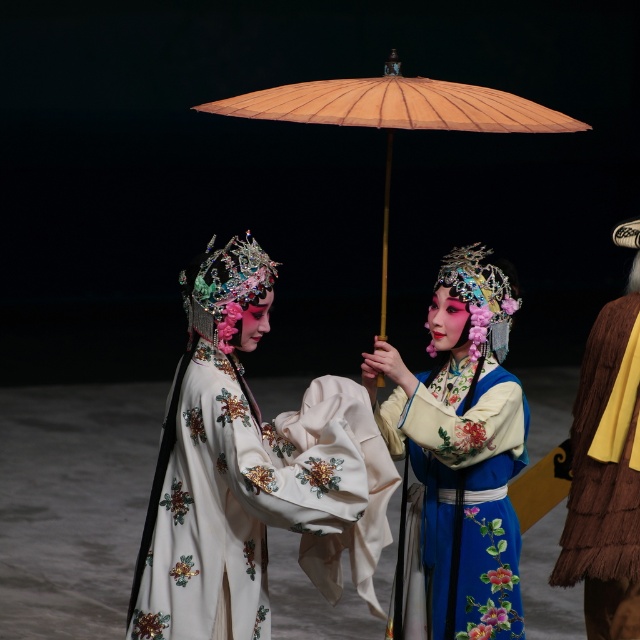
Question: Which point is farther to the camera?

Choices:
 (A) white satin dress at center
 (B) blue silk robe at center
 (C) matte beige parasol at center

Answer: (B)

Question: Does brown fuzzy coat at right come in front of matte beige parasol at center?

Choices:
 (A) yes
 (B) no

Answer: (B)

Question: Is the position of white satin dress at center less distant than that of blue silk robe at center?

Choices:
 (A) yes
 (B) no

Answer: (A)

Question: Is brown fuzzy coat at right positioned behind matte beige parasol at center?

Choices:
 (A) no
 (B) yes

Answer: (B)

Question: Among these objects, which one is farthest from the camera?

Choices:
 (A) matte beige parasol at center
 (B) brown fuzzy coat at right

Answer: (B)

Question: Which of these objects is positioned closest to the white satin dress at center?

Choices:
 (A) matte beige parasol at center
 (B) brown fuzzy coat at right
 (C) blue silk robe at center

Answer: (C)